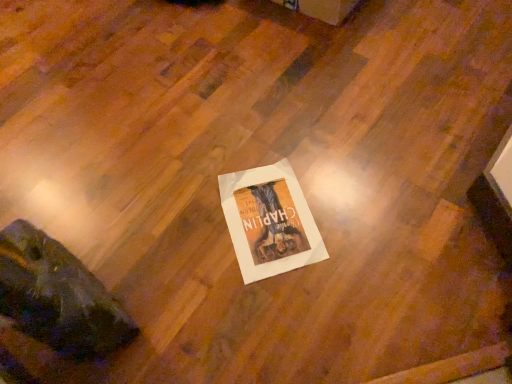
Identify the location of vacant area that lies to the right of white paper book at center. (359, 209).